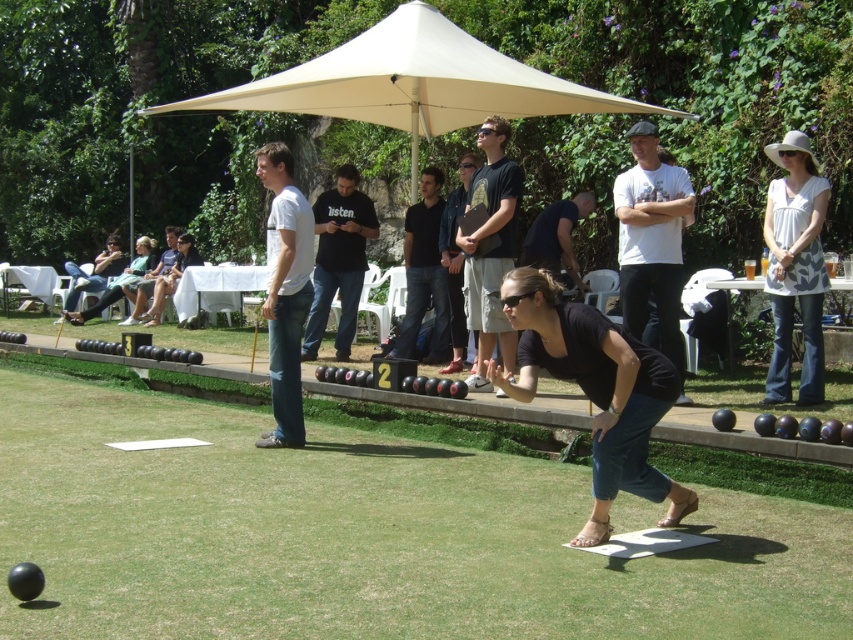
Can you confirm if black matte shirt at center is taller than white cotton shirt at upper right?

No, black matte shirt at center is not taller than white cotton shirt at upper right.

Who is more distant from viewer, (x=608, y=500) or (x=807, y=141)?

Positioned behind is point (x=807, y=141).

Who is more distant from viewer, (515, 294) or (769, 252)?

The point (769, 252) is more distant.

I want to click on black matte shirt at center, so click(x=595, y=392).